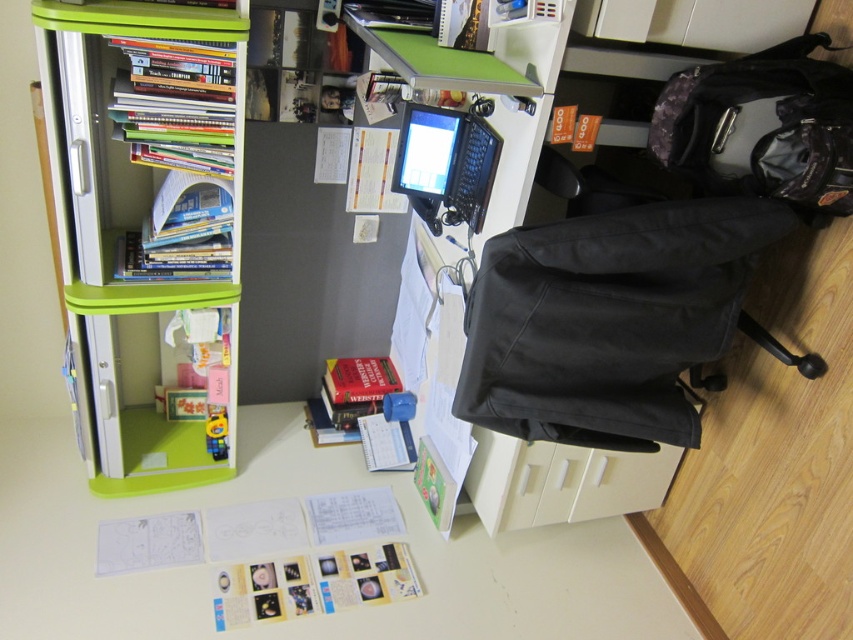
Does green plastic bookshelf at left have a greater width compared to white paper at lower center?

No.

Is point (115, 92) farther from viewer compared to point (62, 444)?

No, (115, 92) is closer to viewer.

Who is more distant from viewer, (125, 374) or (271, 412)?

Positioned behind is point (271, 412).

The width and height of the screenshot is (853, 640). What are the coordinates of `green plastic bookshelf at left` in the screenshot? It's located at (148, 227).

Does green plastic bookshelf at left have a larger size compared to camouflage fabric backpack at right?

Correct, green plastic bookshelf at left is larger in size than camouflage fabric backpack at right.

Can you confirm if green plastic bookshelf at left is taller than camouflage fabric backpack at right?

Correct, green plastic bookshelf at left is much taller as camouflage fabric backpack at right.

The height and width of the screenshot is (640, 853). What do you see at coordinates (148, 227) in the screenshot? I see `green plastic bookshelf at left` at bounding box center [148, 227].

Find the location of a particular element. The height and width of the screenshot is (640, 853). green plastic bookshelf at left is located at coordinates (148, 227).

Consider the image. Is camouflage fabric backpack at right shorter than black plastic laptop at center?

Incorrect, camouflage fabric backpack at right's height does not fall short of black plastic laptop at center's.

Is camouflage fabric backpack at right bigger than black plastic laptop at center?

No.

Between point (850, 204) and point (436, 205), which one is positioned in front?

Positioned in front is point (850, 204).

Locate an element on the screen. The image size is (853, 640). camouflage fabric backpack at right is located at coordinates (762, 125).